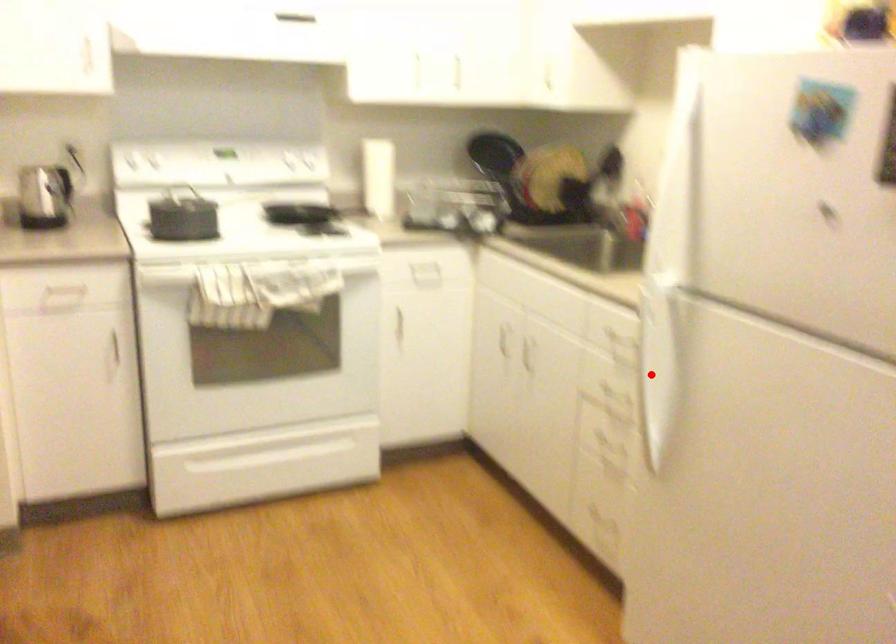
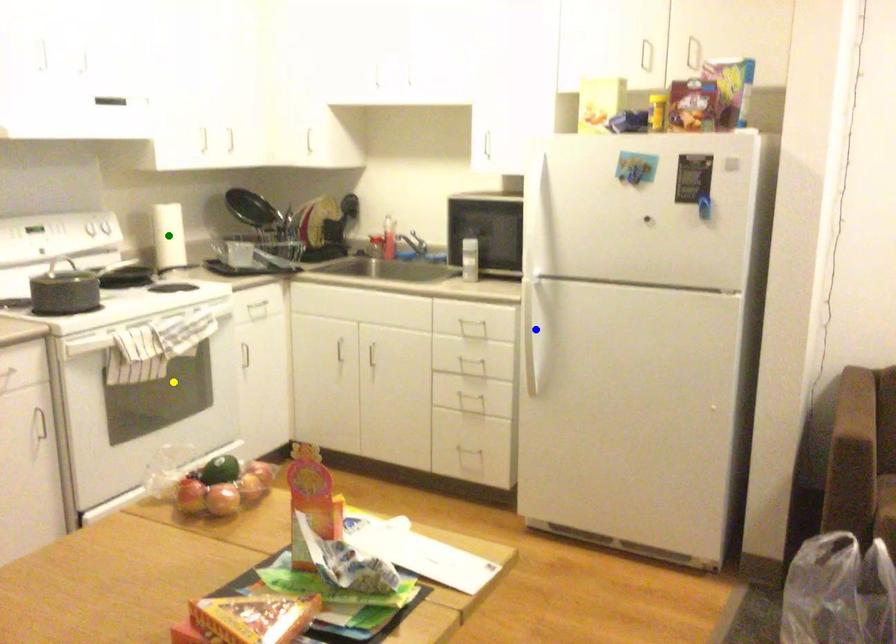
Question: I am providing you with two images of the same scene from different viewpoints. A red point is marked on the first image. You are given multiple points on the second image. Can you choose the point in image 2 that corresponds to the point in image 1?

Choices:
 (A) green point
 (B) blue point
 (C) yellow point

Answer: (B)